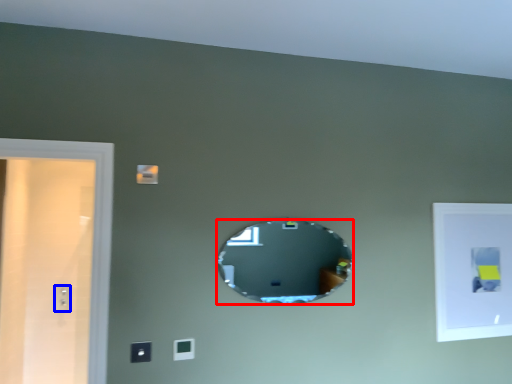
Question: Which of the following is the closest to the observer, mirror (highlighted by a red box) or electric outlet (highlighted by a blue box)?

Choices:
 (A) mirror
 (B) electric outlet

Answer: (A)